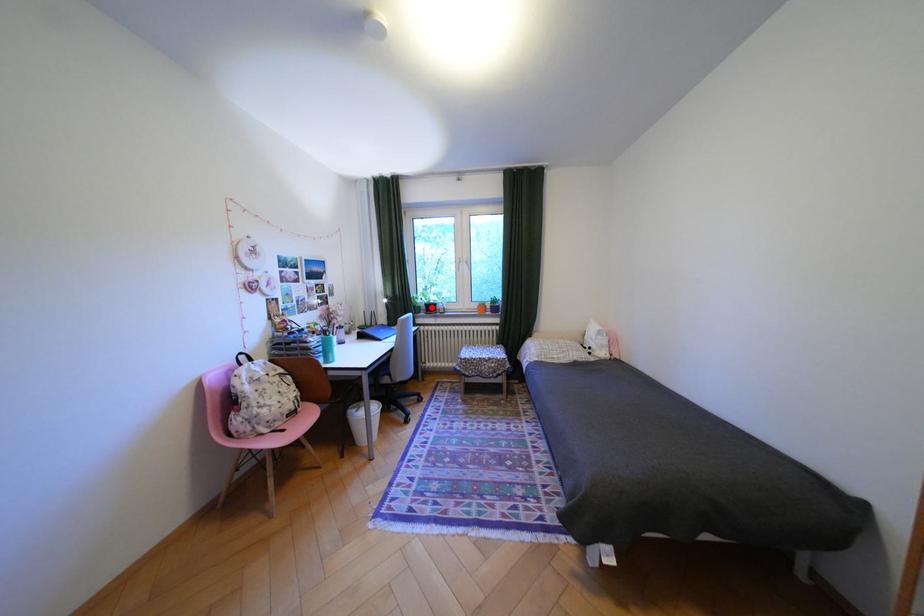
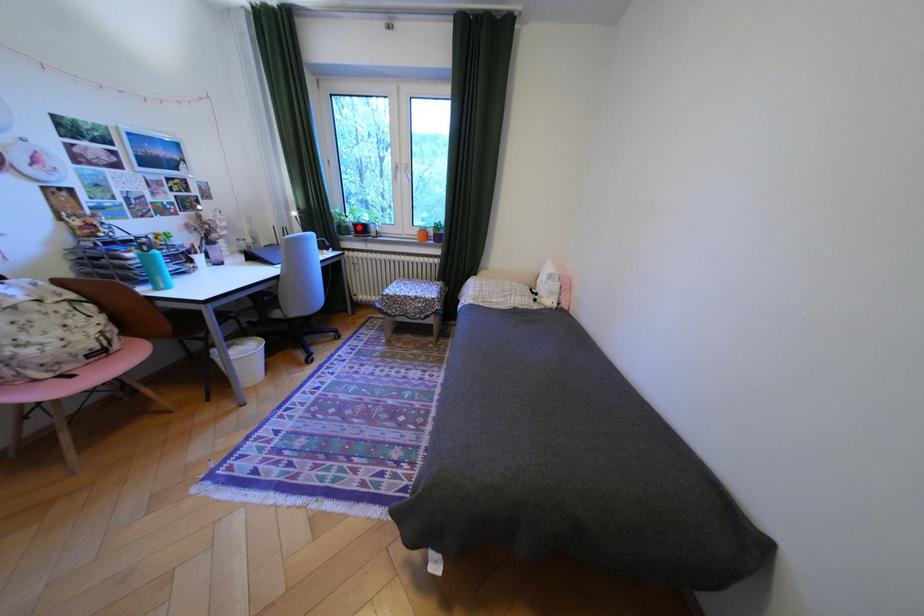
I am providing you with two images of the same scene from different viewpoints. A red point is marked on the first image and another point is marked on the second image. Do the highlighted points in image1 and image2 indicate the same real-world spot?

Yes